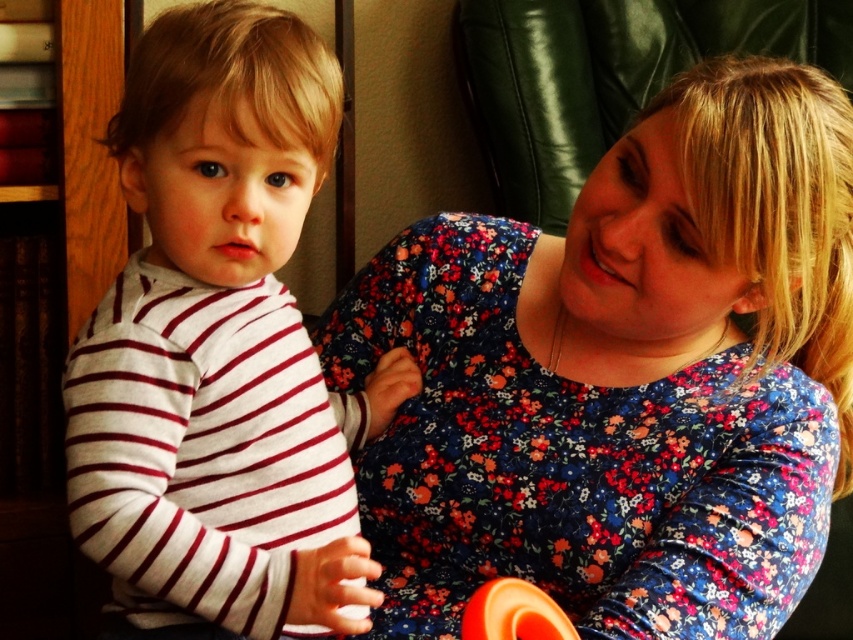
Question: Can you confirm if white striped shirt at left is thinner than orange rubber ring at lower center?

Choices:
 (A) no
 (B) yes

Answer: (A)

Question: Can you confirm if white striped shirt at left is positioned to the left of orange rubber ring at lower center?

Choices:
 (A) yes
 (B) no

Answer: (A)

Question: Considering the relative positions of white striped shirt at left and orange rubber ring at lower center in the image provided, where is white striped shirt at left located with respect to orange rubber ring at lower center?

Choices:
 (A) right
 (B) left

Answer: (B)

Question: Which point is closer to the camera?

Choices:
 (A) (218, 312)
 (B) (474, 605)

Answer: (B)

Question: Considering the real-world distances, which object is farthest from the floral fabric dress at center?

Choices:
 (A) orange rubber ring at lower center
 (B) white striped shirt at left

Answer: (A)

Question: Which point is farther to the camera?

Choices:
 (A) (480, 589)
 (B) (120, 284)
 (C) (782, 296)

Answer: (B)